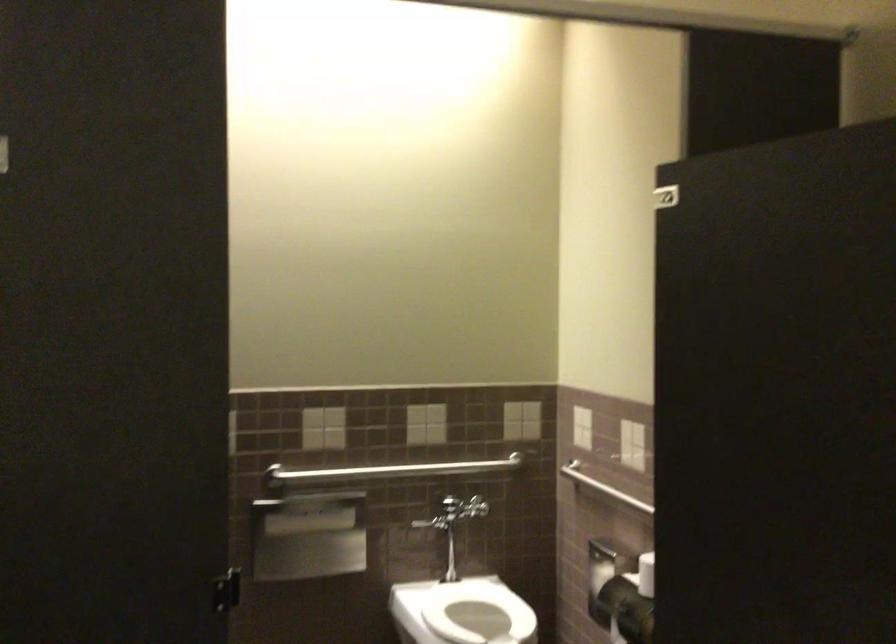
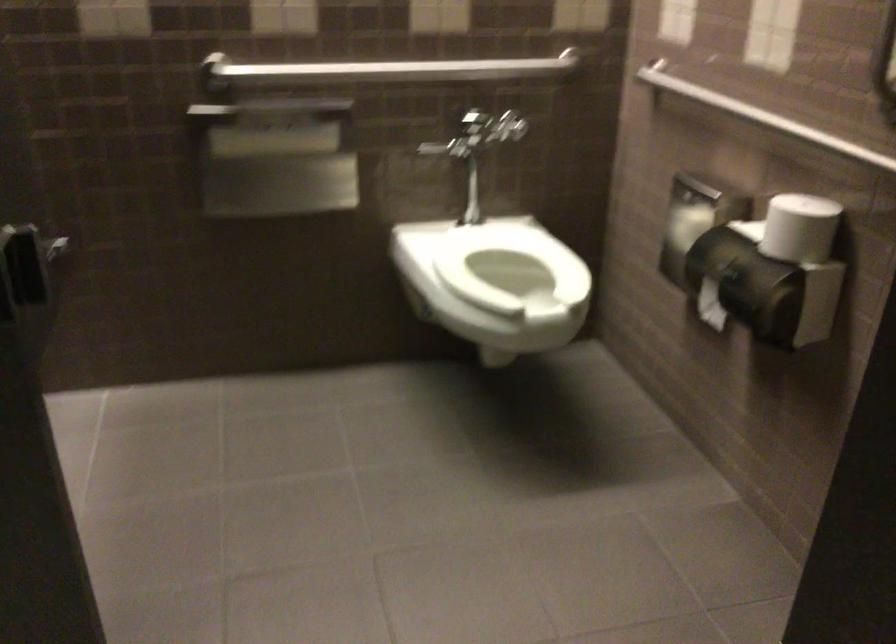
Find the pixel in the second image that matches the point at 391,469 in the first image.

(391, 69)